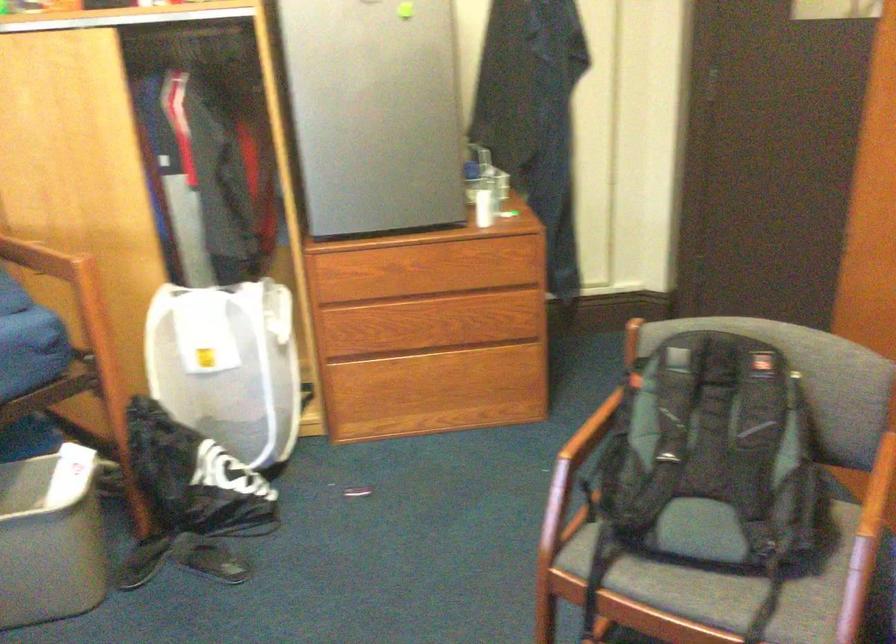
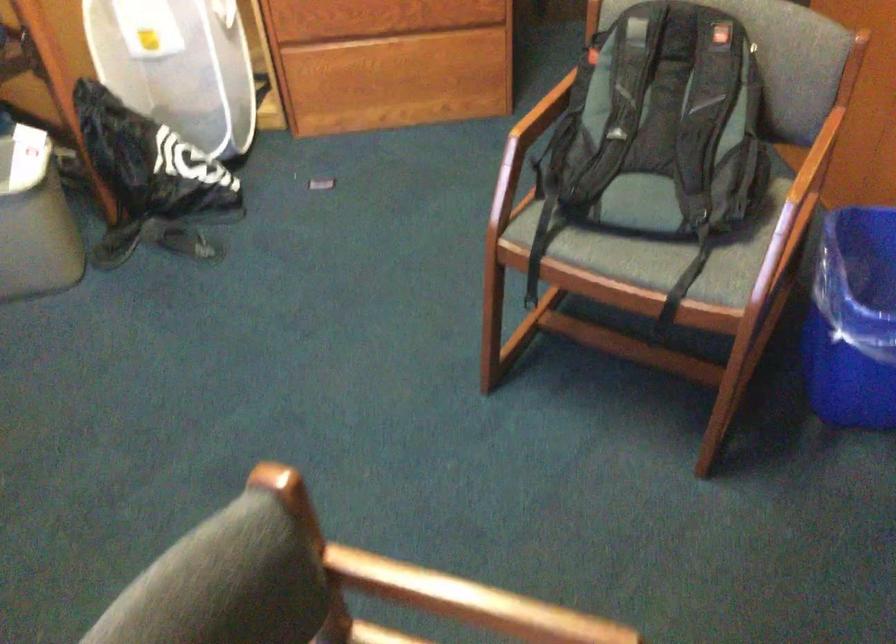
Question: The images are taken continuously from a first-person perspective. In which direction is your viewpoint rotating?

Choices:
 (A) Left
 (B) Right
 (C) Up
 (D) Down

Answer: (D)